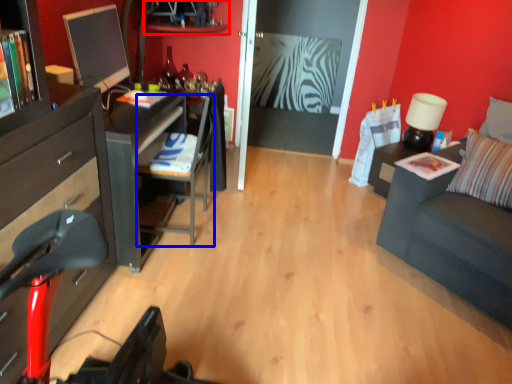
Question: Among these objects, which one is nearest to the camera, shelf (highlighted by a red box) or armchair (highlighted by a blue box)?

Choices:
 (A) shelf
 (B) armchair

Answer: (B)